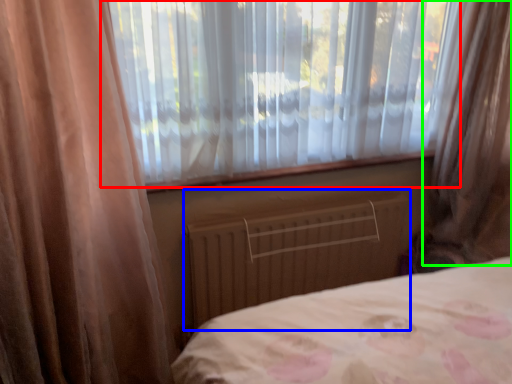
Question: Which is farther away from window (highlighted by a red box)? radiator (highlighted by a blue box) or curtain (highlighted by a green box)?

Choices:
 (A) radiator
 (B) curtain

Answer: (B)